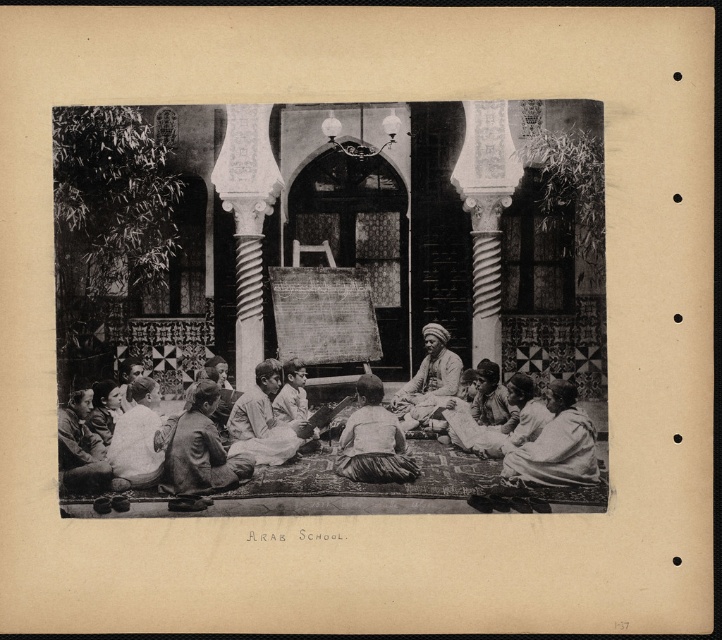
Question: Which point appears closest to the camera in this image?

Choices:
 (A) (235, 458)
 (B) (287, 448)
 (C) (560, 460)
 (D) (434, 408)

Answer: (C)

Question: Which point is farther to the camera?

Choices:
 (A) (108, 384)
 (B) (264, 444)
 (C) (477, 381)

Answer: (A)

Question: Does light brown cotton shirt at center lie behind smooth skin man at lower left?

Choices:
 (A) no
 (B) yes

Answer: (B)

Question: Estimate the real-world distances between objects in this image. Which object is farther from the smooth skin man at lower left?

Choices:
 (A) light beige fabric at lower left
 (B) light brown leather jacket at lower left
 (C) smooth skin face at lower left

Answer: (B)

Question: Is light brown fabric at lower right to the right of light beige fabric at lower left from the viewer's perspective?

Choices:
 (A) no
 (B) yes

Answer: (B)

Question: Does light brown fabric at lower right appear under smooth skin face at lower left?

Choices:
 (A) yes
 (B) no

Answer: (A)